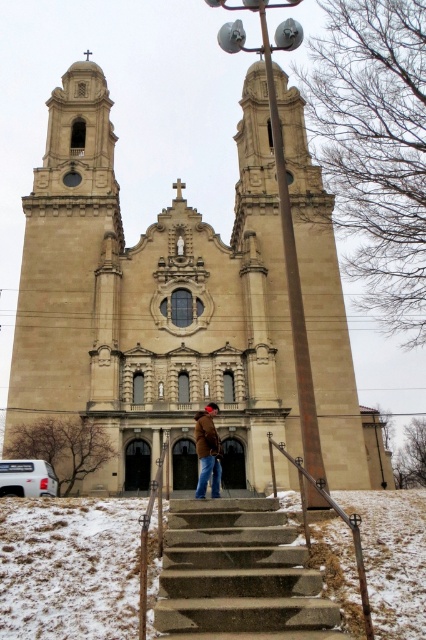
Which is in front, point (85, 304) or point (271, 444)?

Positioned in front is point (271, 444).

Is beige stone church at center shorter than metallic silver railing at lower center?

No, beige stone church at center is not shorter than metallic silver railing at lower center.

Who is more distant from viewer, [198,253] or [304,488]?

The point [198,253] is more distant.

Image resolution: width=426 pixels, height=640 pixels. I want to click on beige stone church at center, so click(150, 298).

Can you confirm if concrete stairs at center is bigger than brown leather coat at center?

Indeed, concrete stairs at center has a larger size compared to brown leather coat at center.

Where is `concrete stairs at center`? The image size is (426, 640). concrete stairs at center is located at coordinates (238, 576).

Identify the location of concrete stairs at center. The width and height of the screenshot is (426, 640). (238, 576).

This screenshot has width=426, height=640. What do you see at coordinates (238, 576) in the screenshot?
I see `concrete stairs at center` at bounding box center [238, 576].

Based on the photo, which is more to the right, concrete stairs at center or metallic silver railing at lower center?

metallic silver railing at lower center

The image size is (426, 640). I want to click on concrete stairs at center, so click(238, 576).

Where is `concrete stairs at center`? The image size is (426, 640). concrete stairs at center is located at coordinates (238, 576).